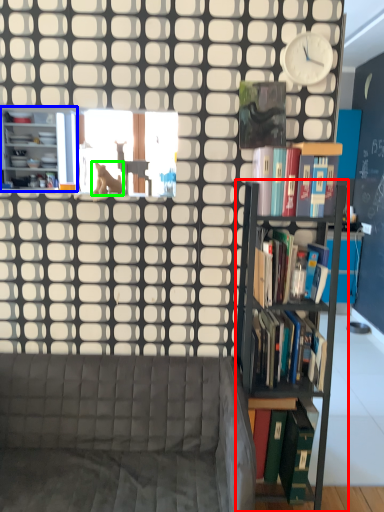
Question: Based on their relative distances, which object is farther from shelf (highlighted by a red box)? Choose from bookcase (highlighted by a blue box) and animal (highlighted by a green box).

Choices:
 (A) bookcase
 (B) animal

Answer: (A)